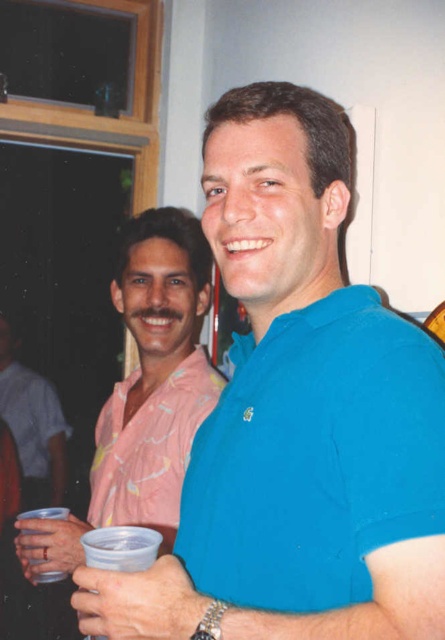
Question: Is white plastic cup at center positioned in front of matte pink shirt at center?

Choices:
 (A) no
 (B) yes

Answer: (B)

Question: Can you confirm if matte blue polo shirt at center is positioned to the right of matte plastic cup at lower left?

Choices:
 (A) yes
 (B) no

Answer: (A)

Question: Can you confirm if pink floral shirt at left is positioned above white plastic cup at center?

Choices:
 (A) no
 (B) yes

Answer: (B)

Question: Which of the following is the farthest from the observer?

Choices:
 (A) (109, 468)
 (B) (105, 625)
 (C) (242, 592)

Answer: (A)

Question: Which object appears closest to the camera in this image?

Choices:
 (A) matte blue polo shirt at center
 (B) matte plastic cup at lower left
 (C) white plastic cup at center
 (D) blue cotton shirt at center

Answer: (D)

Question: Based on their relative distances, which object is nearer to the matte blue polo shirt at center?

Choices:
 (A) blue cotton shirt at center
 (B) pink floral shirt at left
 (C) white plastic cup at center

Answer: (A)